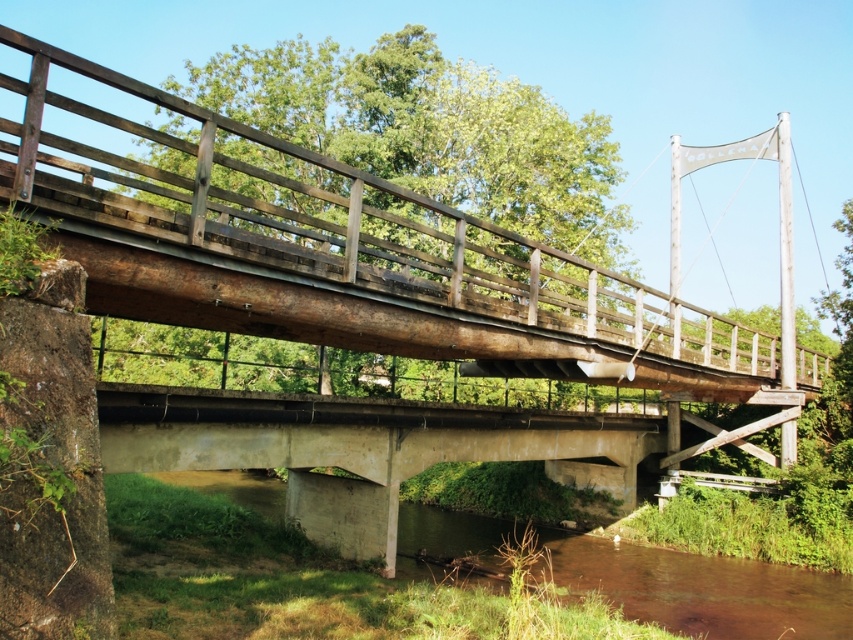
Question: Is rusty wood rail at upper center to the right of brown concrete river at lower center from the viewer's perspective?

Choices:
 (A) no
 (B) yes

Answer: (B)

Question: Is rusty wood rail at upper center below brown concrete river at lower center?

Choices:
 (A) yes
 (B) no

Answer: (B)

Question: Is rusty wood rail at upper center positioned behind brown concrete river at lower center?

Choices:
 (A) no
 (B) yes

Answer: (A)